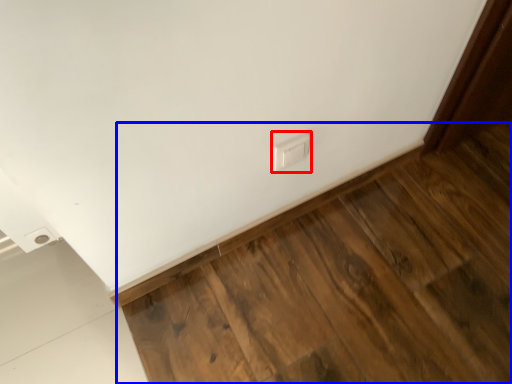
Question: Which object appears farthest to the camera in this image, electric outlet (highlighted by a red box) or hardwood (highlighted by a blue box)?

Choices:
 (A) electric outlet
 (B) hardwood

Answer: (A)